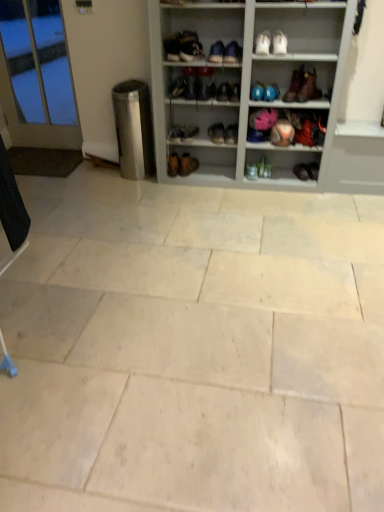
Question: From the image's perspective, does white leather shoe at upper center, which is the 5th shoe in right-to-left order, appear higher than natural stone tile at center?

Choices:
 (A) no
 (B) yes

Answer: (B)

Question: Is white leather shoe at upper center, which is the second shoe from left to right, at the right side of natural stone tile at center?

Choices:
 (A) yes
 (B) no

Answer: (A)

Question: From a real-world perspective, is white leather shoe at upper center, which is the second shoe from left to right, under natural stone tile at center?

Choices:
 (A) yes
 (B) no

Answer: (B)

Question: Considering the relative sizes of white leather shoe at upper center, which is the second shoe from left to right, and natural stone tile at center in the image provided, is white leather shoe at upper center, which is the second shoe from left to right, shorter than natural stone tile at center?

Choices:
 (A) no
 (B) yes

Answer: (A)

Question: Considering the relative sizes of white leather shoe at upper center, which is the second shoe from left to right, and natural stone tile at center in the image provided, is white leather shoe at upper center, which is the second shoe from left to right, thinner than natural stone tile at center?

Choices:
 (A) yes
 (B) no

Answer: (A)

Question: Does point (261, 170) appear closer or farther from the camera than point (274, 53)?

Choices:
 (A) farther
 (B) closer

Answer: (A)

Question: In terms of width, does matte blue shoe at center, the sixth shoe from the left, look wider or thinner when compared to matte black boot at upper center, the 7th footwear in the left-to-right sequence?

Choices:
 (A) wide
 (B) thin

Answer: (B)

Question: In the image, is matte blue shoe at center, the sixth shoe from the left, positioned in front of or behind matte black boot at upper center, which is counted as the 4th footwear, starting from the right?

Choices:
 (A) front
 (B) behind

Answer: (B)

Question: Is matte blue shoe at center, the 1th shoe in the right-to-left sequence, situated inside matte black boot at upper center, the 7th footwear in the left-to-right sequence, or outside?

Choices:
 (A) outside
 (B) inside

Answer: (A)

Question: Looking at the image, does matte black shoe at center, which is the 6th shoe from right to left, seem bigger or smaller compared to white leather shoe at upper center, which is the second shoe from left to right?

Choices:
 (A) big
 (B) small

Answer: (B)

Question: Considering the positions of point (177, 93) and point (188, 38), is point (177, 93) closer or farther from the camera than point (188, 38)?

Choices:
 (A) farther
 (B) closer

Answer: (A)

Question: From a real-world perspective, relative to white leather shoe at upper center, which is the second shoe from left to right, is matte black shoe at center, placed as the first shoe when sorted from left to right, vertically above or below?

Choices:
 (A) above
 (B) below

Answer: (B)

Question: Is matte black shoe at center, which is the 6th shoe from right to left, wider or thinner than white leather shoe at upper center, which is the 5th shoe in right-to-left order?

Choices:
 (A) thin
 (B) wide

Answer: (B)

Question: Relative to brown leather boot at upper right, the 9th footwear when ordered from left to right, is matte black shoe at center, the 4th shoe when ordered from left to right, in front or behind?

Choices:
 (A) front
 (B) behind

Answer: (B)

Question: From the image's perspective, relative to brown leather boot at upper right, the 2th footwear from the right, is matte black shoe at center, which ranks as the 3th shoe in right-to-left order, above or below?

Choices:
 (A) above
 (B) below

Answer: (B)